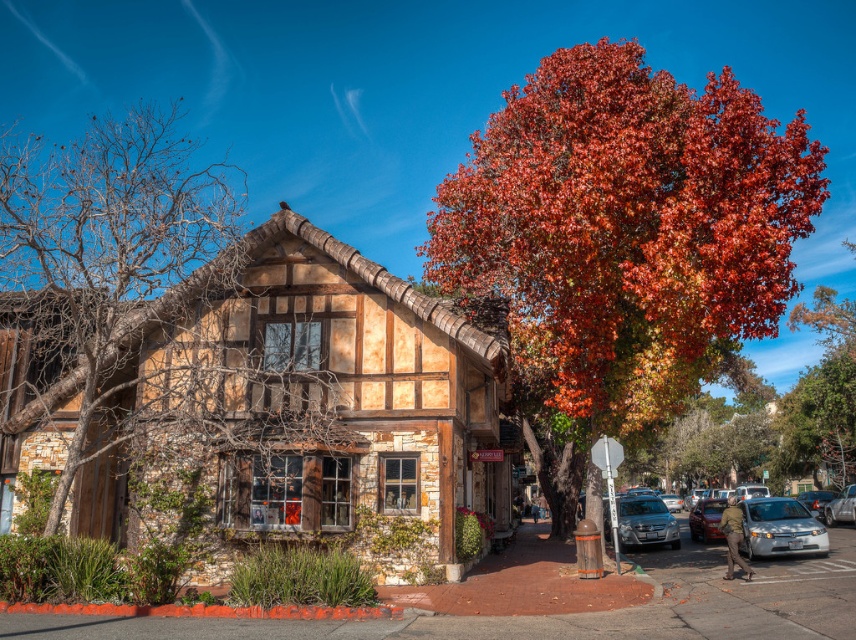
Identify the location of satin silver sedan at center. The height and width of the screenshot is (640, 856). click(x=645, y=522).

Who is taller, satin silver sedan at center or shiny silver sedan at center right?

shiny silver sedan at center right

Between point (669, 529) and point (691, 529), which one is positioned behind?

The point (691, 529) is more distant.

This screenshot has height=640, width=856. In order to click on satin silver sedan at center in this screenshot , I will do `click(645, 522)`.

Which is more to the left, silver metallic sedan at lower right or satin silver sedan at center?

satin silver sedan at center is more to the left.

Who is more distant from viewer, (818, 538) or (617, 506)?

Positioned behind is point (617, 506).

Locate an element on the screen. This screenshot has height=640, width=856. silver metallic sedan at lower right is located at coordinates (780, 529).

Does point (268, 248) come in front of point (693, 516)?

Yes, it is in front of point (693, 516).

Which is above, wooden/timbered hut at center or shiny silver sedan at center right?

wooden/timbered hut at center

What do you see at coordinates (271, 413) in the screenshot? The image size is (856, 640). I see `wooden/timbered hut at center` at bounding box center [271, 413].

Identify the location of wooden/timbered hut at center. (271, 413).